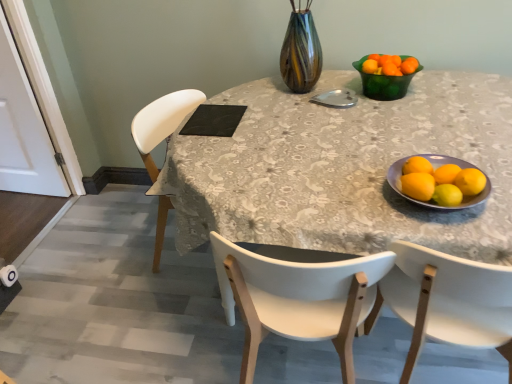
Where is `free point to the right of black matte placemat at upper center`? free point to the right of black matte placemat at upper center is located at coordinates (252, 112).